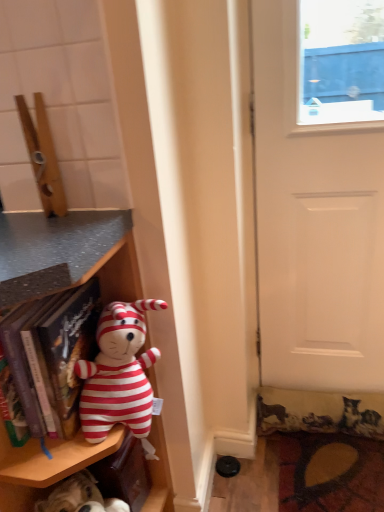
Question: From a real-world perspective, is matte plastic shelf at left positioned above or below striped fabric plush toy at left?

Choices:
 (A) above
 (B) below

Answer: (B)

Question: Based on their sizes in the image, would you say matte plastic shelf at left is bigger or smaller than striped fabric plush toy at left?

Choices:
 (A) big
 (B) small

Answer: (A)

Question: Which of these objects is positioned closest to the fluffy carpet at lower right?

Choices:
 (A) striped fabric plush toy at left
 (B) hardcover book at left
 (C) matte plastic shelf at left
 (D) white matte door at right

Answer: (D)

Question: Based on their relative distances, which object is nearer to the hardcover book at left?

Choices:
 (A) matte plastic shelf at left
 (B) fluffy carpet at lower right
 (C) striped fabric plush toy at left
 (D) white matte door at right

Answer: (C)